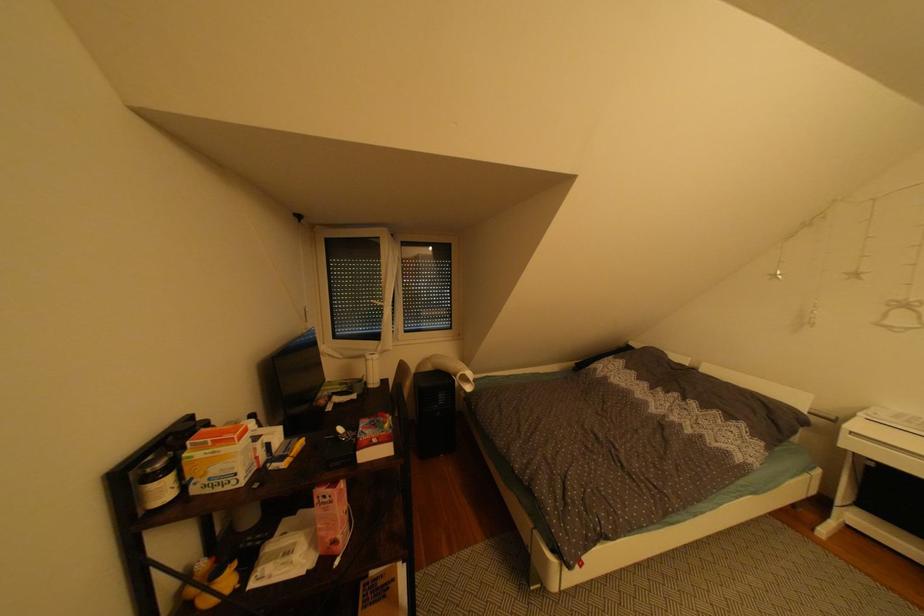
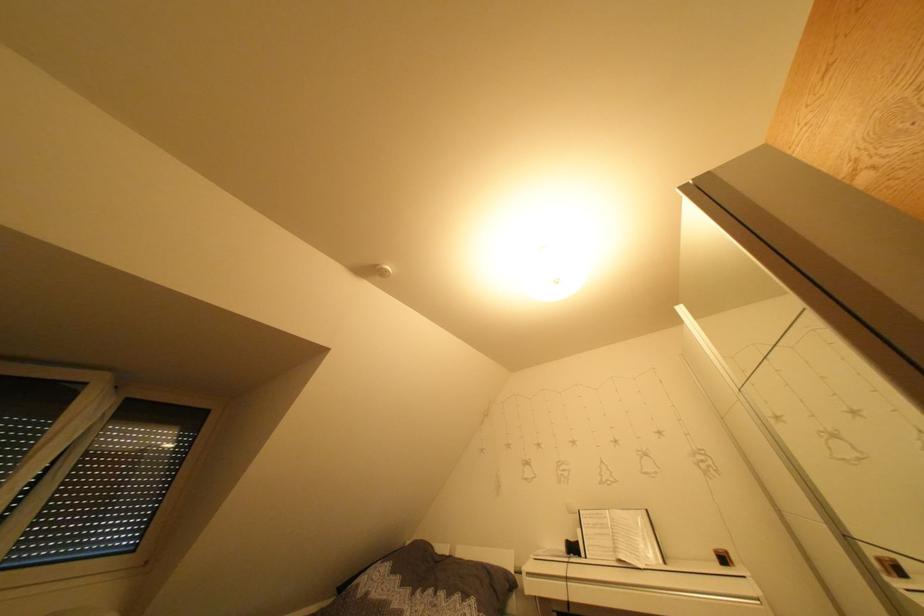
How did the camera likely rotate?

The camera rotated toward right-up.